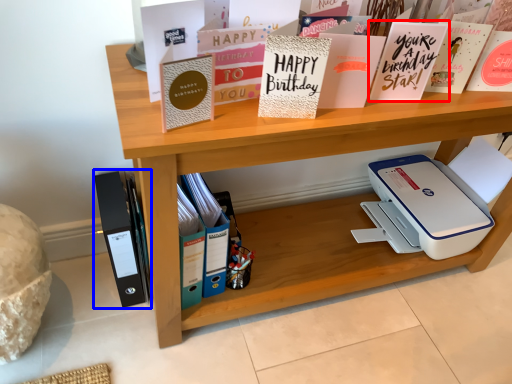
Question: Which object appears closest to the camera in this image, paperback book (highlighted by a red box) or journal (highlighted by a blue box)?

Choices:
 (A) paperback book
 (B) journal

Answer: (A)